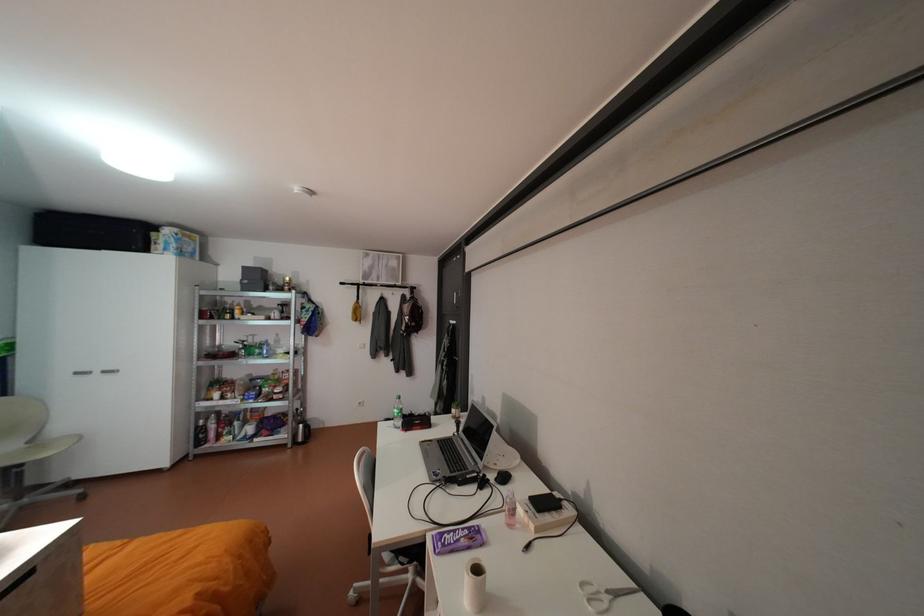
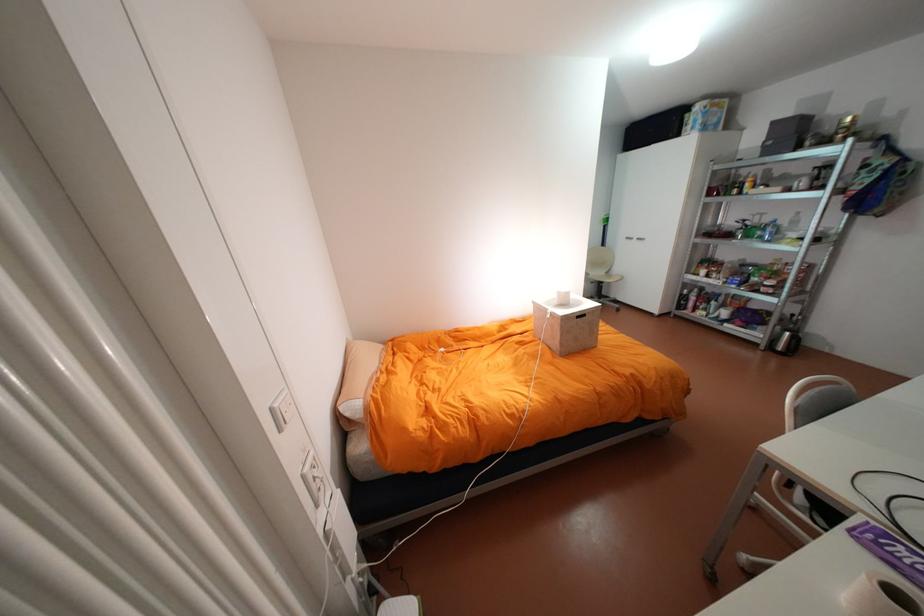
Find the pixel in the second image that matches (x=86, y=371) in the first image.

(636, 237)